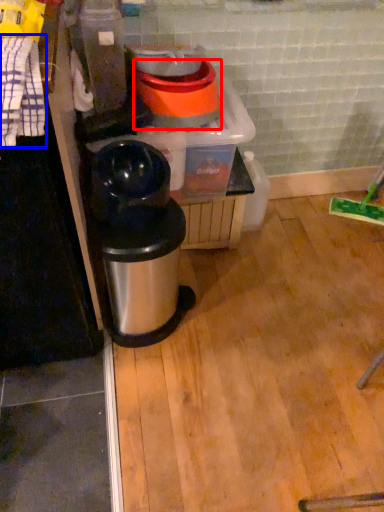
Question: Which object appears farthest to the camera in this image, appliance (highlighted by a red box) or laundry (highlighted by a blue box)?

Choices:
 (A) appliance
 (B) laundry

Answer: (A)